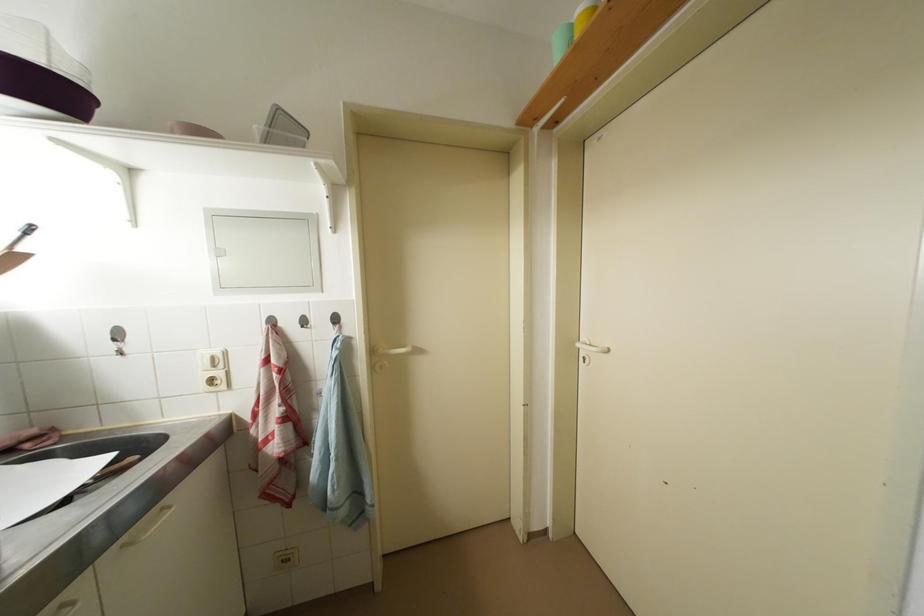
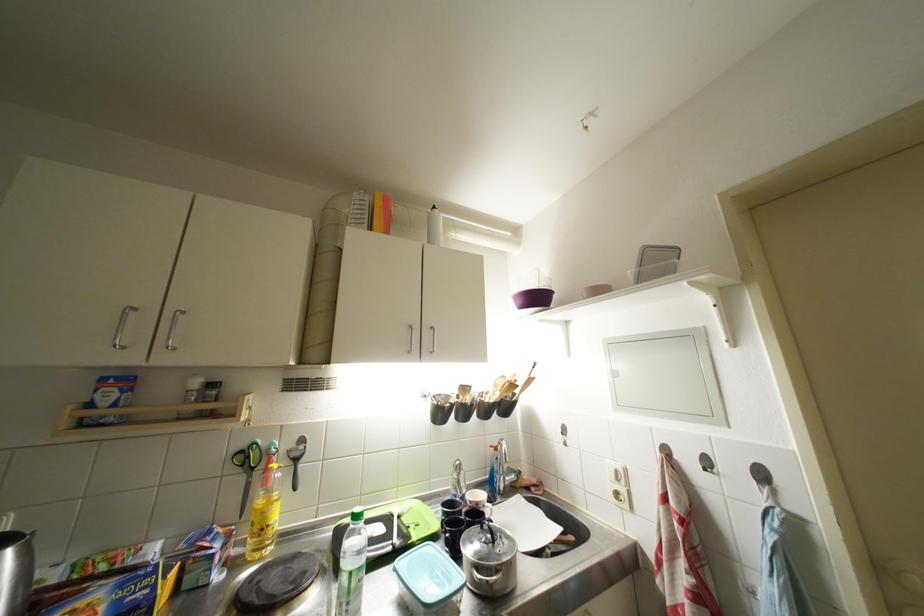
Question: The images are taken continuously from a first-person perspective. In which direction is your viewpoint rotating?

Choices:
 (A) Left
 (B) Right
 (C) Up
 (D) Down

Answer: (A)